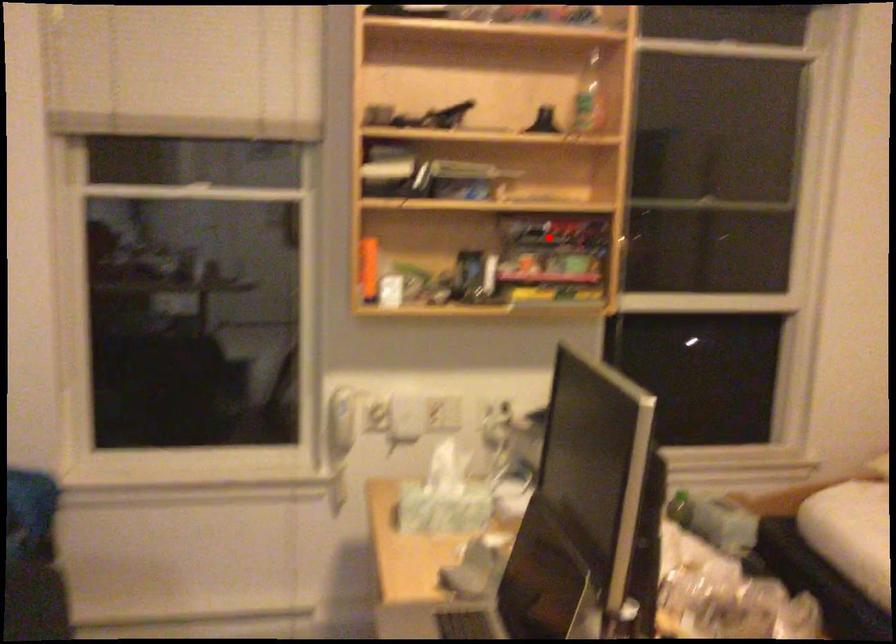
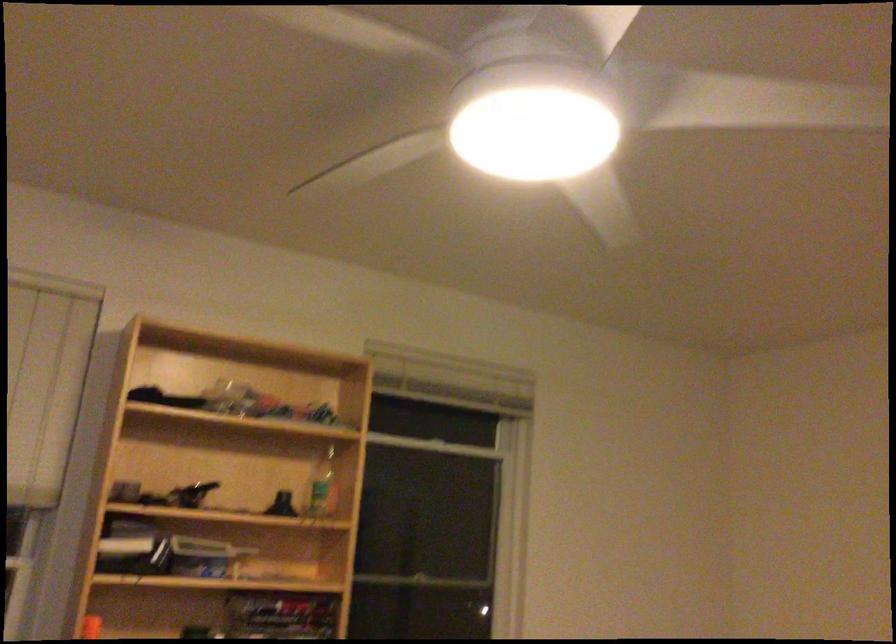
Locate, in the second image, the point that corresponds to the highlighted location in the first image.

(281, 614)